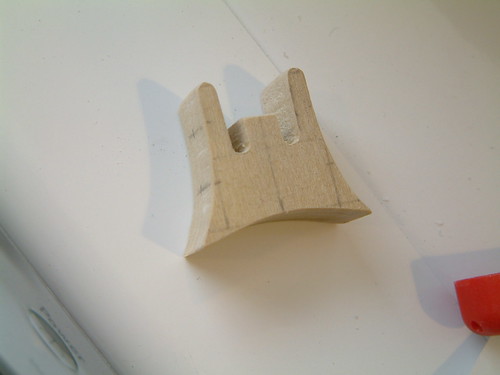
This screenshot has height=375, width=500. Identify the location of white tabletop. (385, 126).